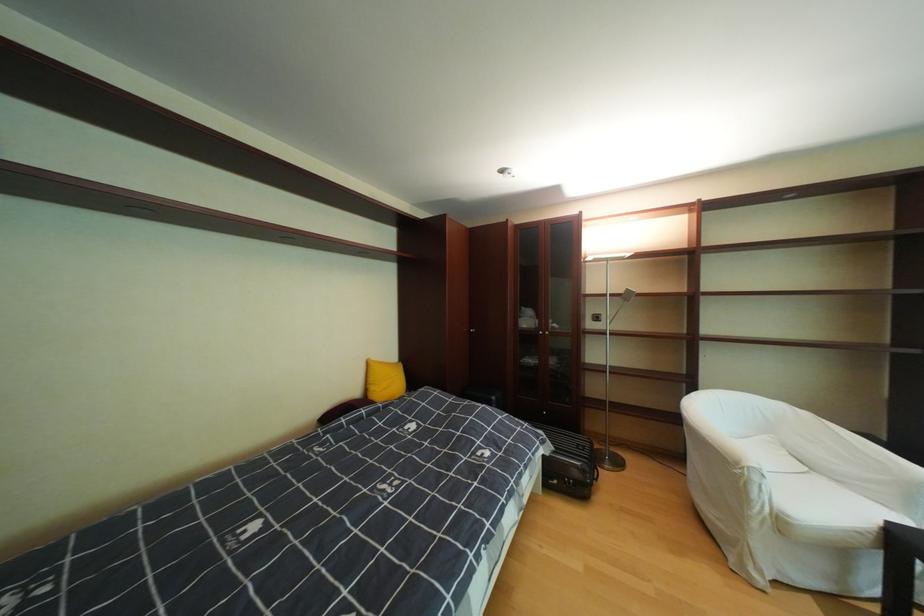
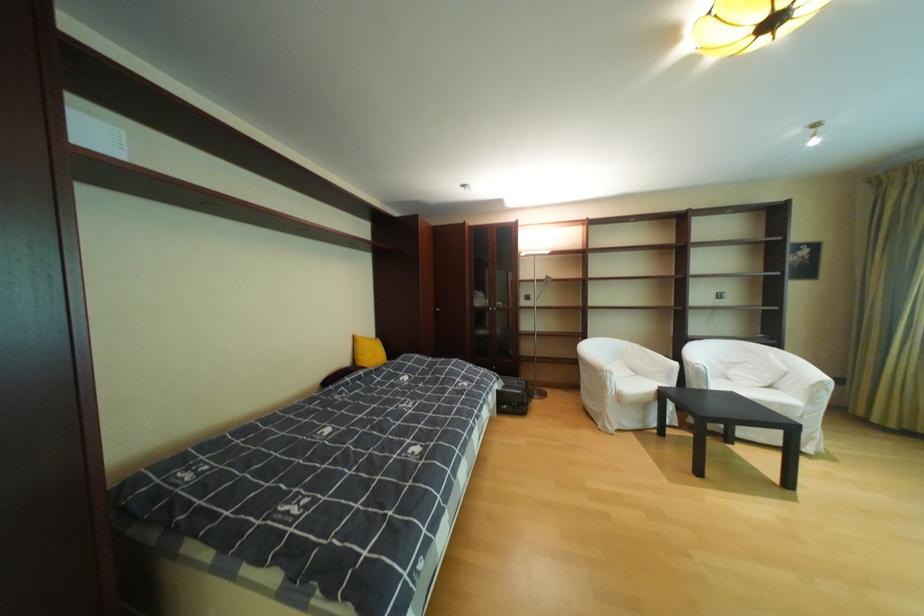
Locate, in the second image, the point that corresponds to the point at 380,363 in the first image.

(367, 339)